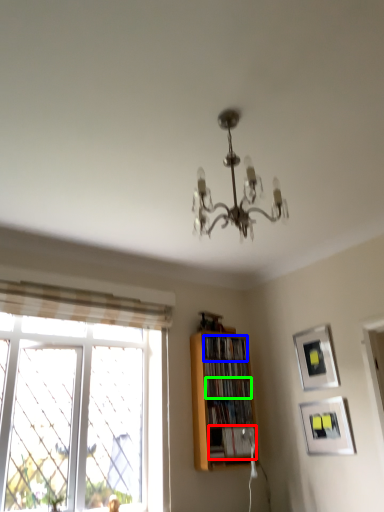
Question: Based on their relative distances, which object is farther from book (highlighted by a red box)? Choose from book (highlighted by a blue box) and book (highlighted by a green box).

Choices:
 (A) book
 (B) book

Answer: (A)